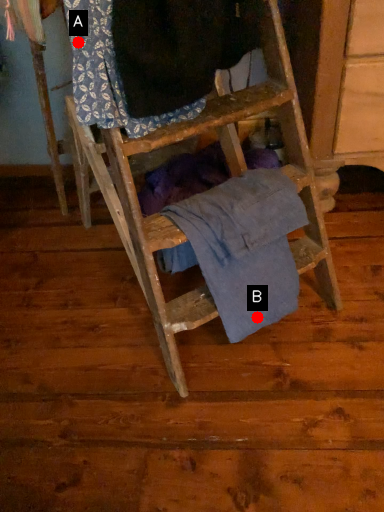
Question: Two points are circled on the image, labeled by A and B beside each circle. Which point appears farthest from the camera in this image?

Choices:
 (A) A is further
 (B) B is further

Answer: (B)